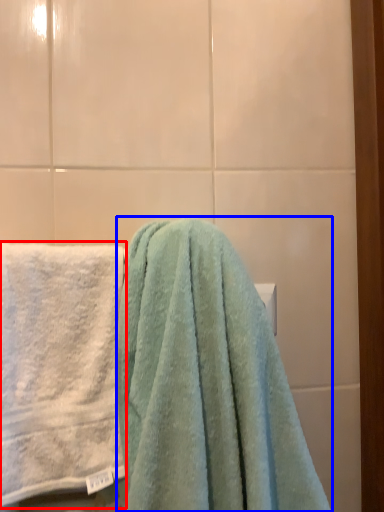
Question: Which point is further to the camera, towel (highlighted by a red box) or towel (highlighted by a blue box)?

Choices:
 (A) towel
 (B) towel

Answer: (A)